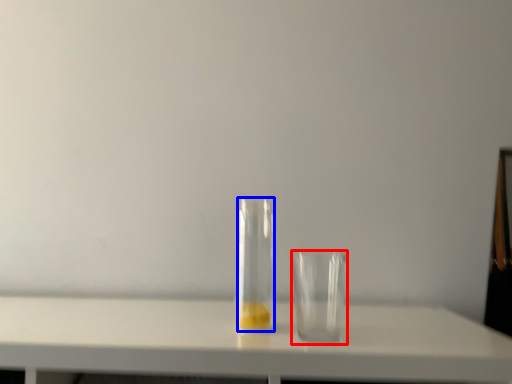
Question: Which of the following is the closest to the observer, tableware (highlighted by a red box) or bottle (highlighted by a blue box)?

Choices:
 (A) tableware
 (B) bottle

Answer: (A)